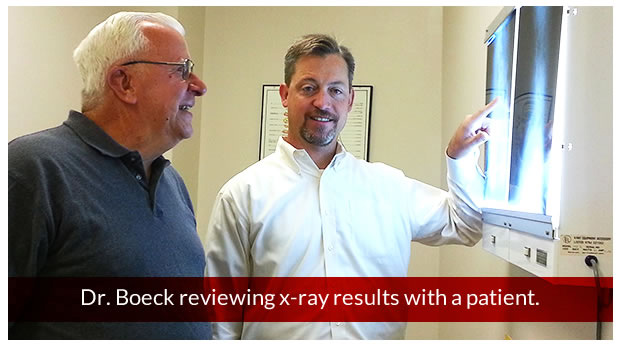
Image resolution: width=621 pixels, height=346 pixels. I want to click on light, so click(x=531, y=175).